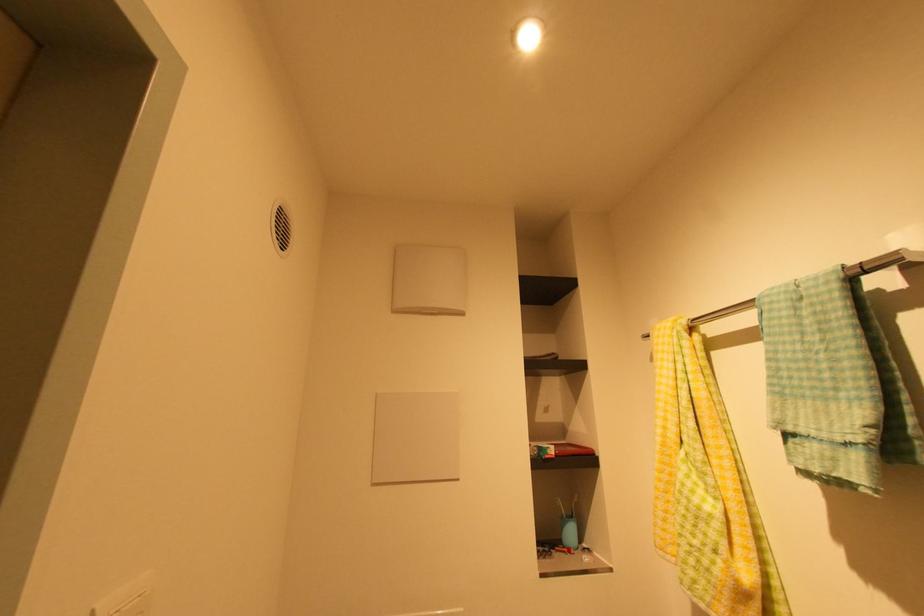
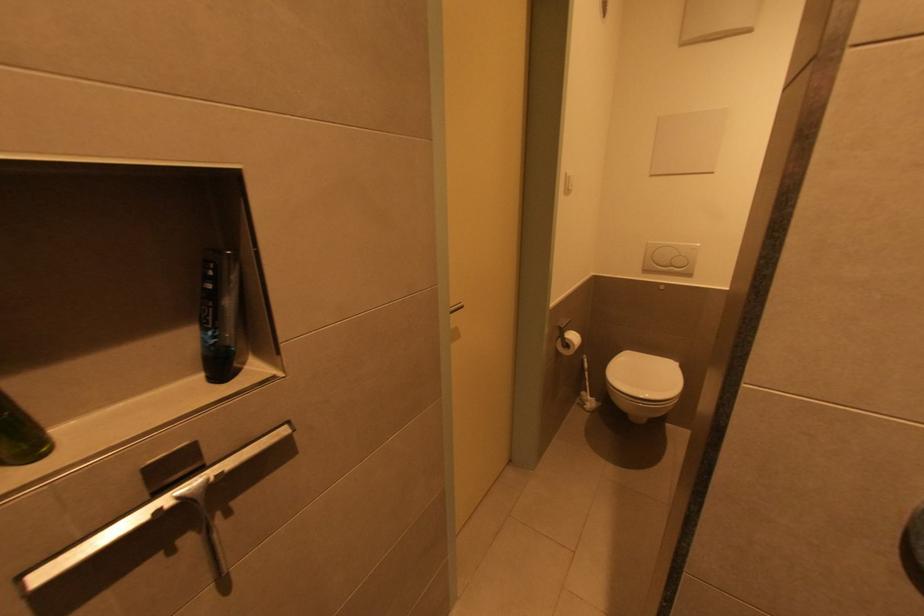
How did the camera likely rotate?

The camera's rotation is toward left-down.